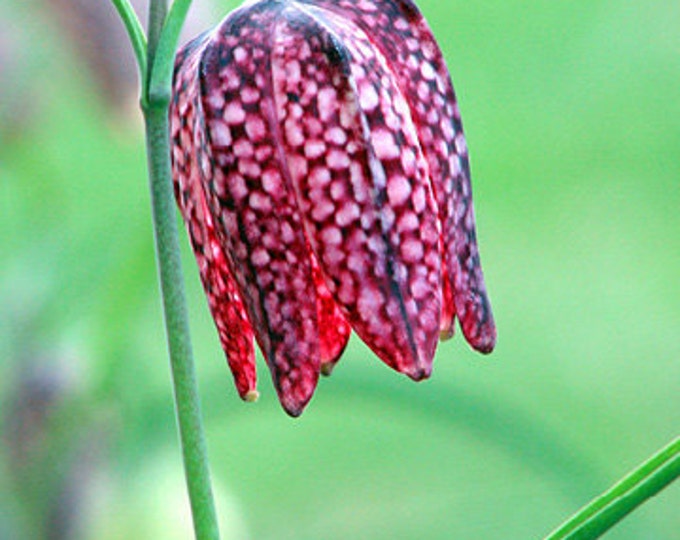
The width and height of the screenshot is (680, 540). What are the coordinates of `bulb` in the screenshot? It's located at (241, 55).